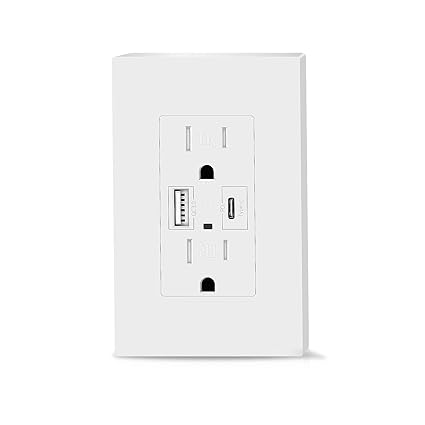
Where is `socket`? This screenshot has height=425, width=425. socket is located at coordinates (209, 207).